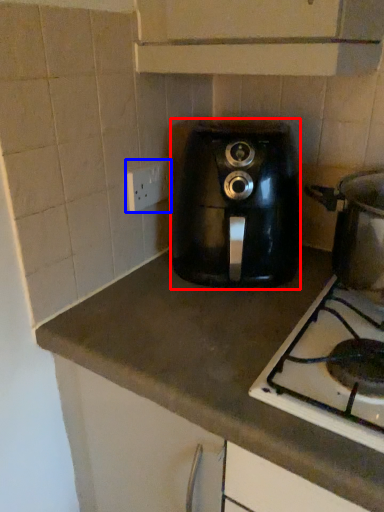
Question: Which object appears closest to the camera in this image, home appliance (highlighted by a red box) or electric outlet (highlighted by a blue box)?

Choices:
 (A) home appliance
 (B) electric outlet

Answer: (A)